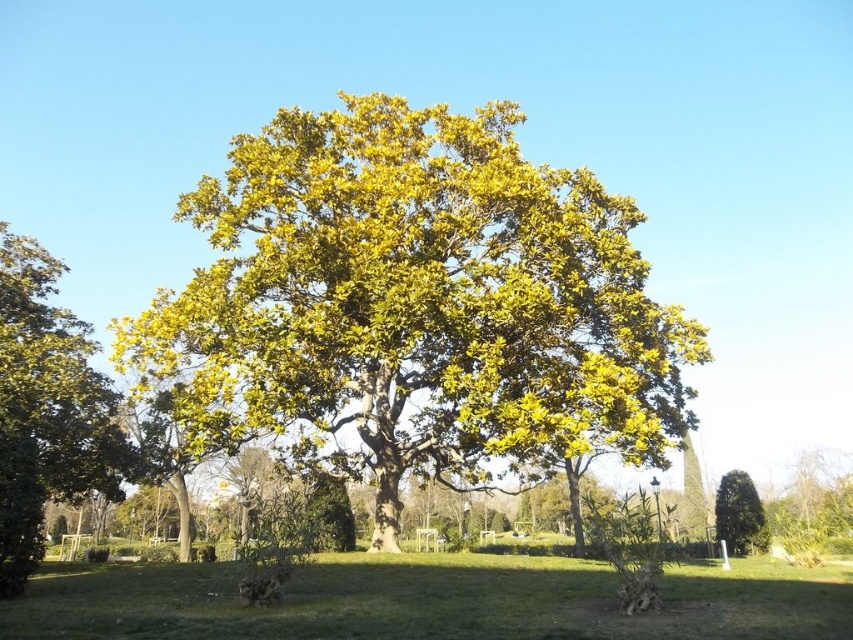
The image size is (853, 640). What do you see at coordinates (431, 602) in the screenshot?
I see `green grass at center` at bounding box center [431, 602].

Is green grass at center positioned behind green leafy tree at left?

No.

Which is in front, point (183, 605) or point (9, 288)?

Point (183, 605) is in front.

Locate an element on the screen. The width and height of the screenshot is (853, 640). green grass at center is located at coordinates (431, 602).

You are a GUI agent. You are given a task and a screenshot of the screen. Output one action in this format:
    pyautogui.click(x=<x>, y=<y>)
    Task: Click on the green leafy oak tree at center
    
    Given the screenshot: What is the action you would take?
    pyautogui.click(x=415, y=301)

Can you confirm if green leafy oak tree at center is positioned above green glossy tree at lower right?

Yes.

Find the location of a particular element. The width and height of the screenshot is (853, 640). green leafy oak tree at center is located at coordinates (415, 301).

Identify the location of green leafy oak tree at center. The height and width of the screenshot is (640, 853). (415, 301).

Between point (245, 157) and point (97, 605), which one is positioned in front?

Point (97, 605)

Does green leafy oak tree at center have a larger size compared to green grass at center?

Correct, green leafy oak tree at center is larger in size than green grass at center.

I want to click on green leafy oak tree at center, so (415, 301).